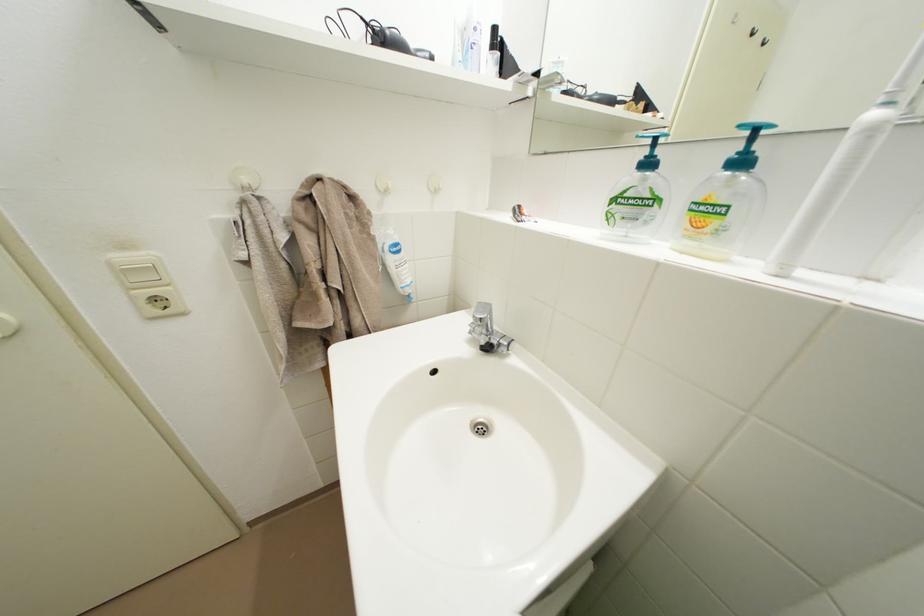
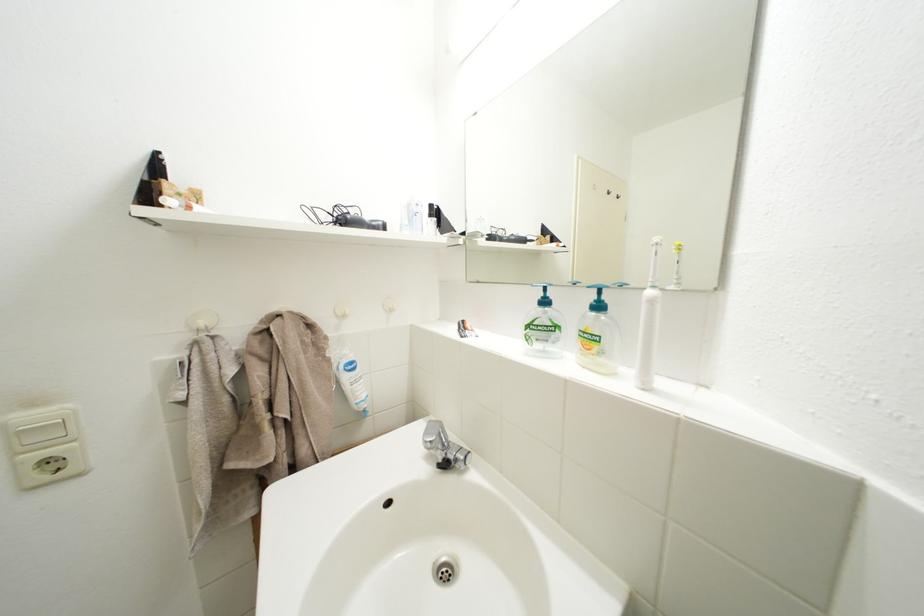
Locate, in the second image, the point that corresponds to (883,120) in the first image.

(659, 298)